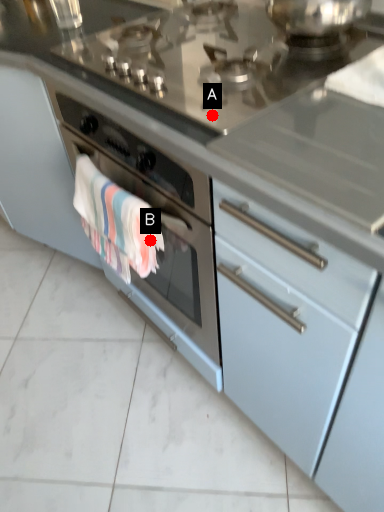
Question: Two points are circled on the image, labeled by A and B beside each circle. Which point is closer to the camera?

Choices:
 (A) A is closer
 (B) B is closer

Answer: (B)